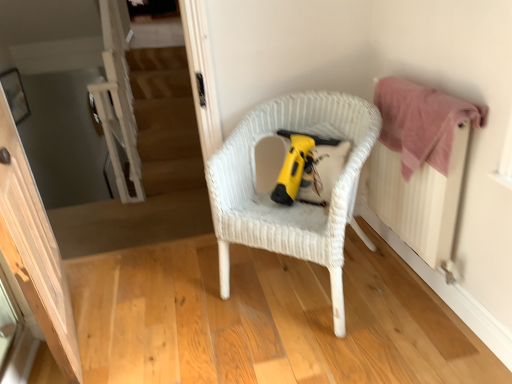
Question: From a real-world perspective, is white wicker chair at center above or below yellow plastic vacuum cleaner at center?

Choices:
 (A) above
 (B) below

Answer: (B)

Question: Is white wicker chair at center in front of or behind yellow plastic vacuum cleaner at center in the image?

Choices:
 (A) front
 (B) behind

Answer: (A)

Question: Based on their relative distances, which object is nearer to the pink fabric radiator at right?

Choices:
 (A) pink cotton towel at upper right
 (B) wooden floor at center
 (C) transparent glass screen door at left
 (D) yellow plastic vacuum cleaner at center
 (E) white wicker chair at center

Answer: (A)

Question: Which is farther from the wooden floor at center?

Choices:
 (A) transparent glass screen door at left
 (B) yellow plastic vacuum cleaner at center
 (C) white wicker chair at center
 (D) pink fabric radiator at right
 (E) pink cotton towel at upper right

Answer: (E)